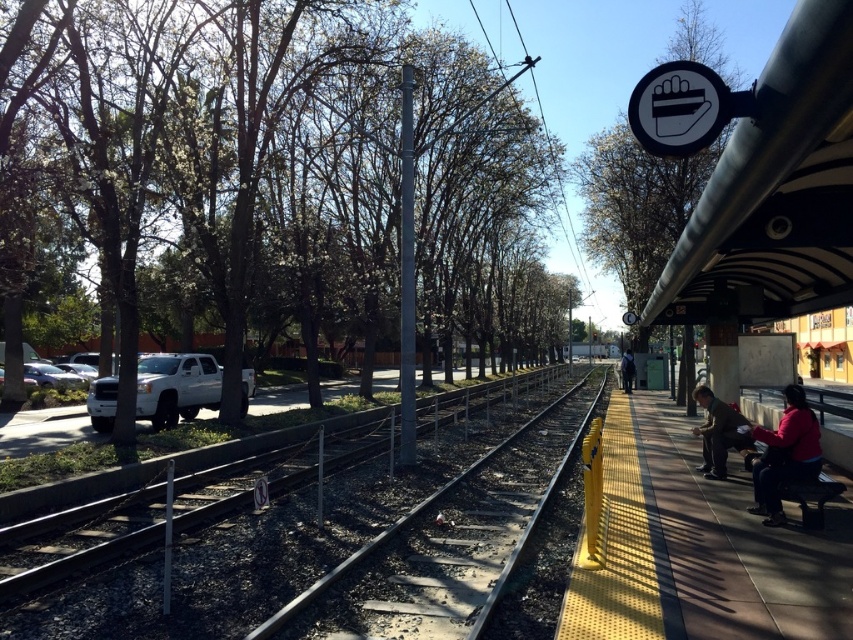
Which is behind, point (799, 400) or point (625, 374)?

The point (625, 374) is behind.

Which is more to the right, red fabric jacket at lower right or dark blue jeans at right?

dark blue jeans at right

Is point (782, 428) closer to camera compared to point (621, 376)?

That is True.

Where is `red fabric jacket at lower right`? The image size is (853, 640). red fabric jacket at lower right is located at coordinates (785, 454).

Can you confirm if metal train track at center is positioned to the left of dark blue jeans at right?

Yes, metal train track at center is to the left of dark blue jeans at right.

Which is in front, point (67, 579) or point (625, 392)?

Point (67, 579) is in front.

I want to click on metal train track at center, so click(x=253, y=536).

Is metal train track at center in front of red fabric jacket at lower right?

That is True.

Between metal train track at center and red fabric jacket at lower right, which one appears on the right side from the viewer's perspective?

Positioned to the right is red fabric jacket at lower right.

Image resolution: width=853 pixels, height=640 pixels. What do you see at coordinates (253, 536) in the screenshot?
I see `metal train track at center` at bounding box center [253, 536].

You are a GUI agent. You are given a task and a screenshot of the screen. Output one action in this format:
    pyautogui.click(x=<x>, y=<y>)
    Task: Click on the metal train track at center
    This screenshot has height=640, width=853.
    Given the screenshot: What is the action you would take?
    pyautogui.click(x=253, y=536)